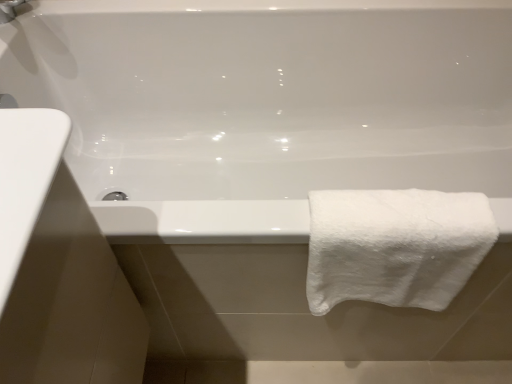
Question: In the image, is matte silver faucet at upper left on the left side or the right side of white fluffy towel at right?

Choices:
 (A) right
 (B) left

Answer: (B)

Question: Is matte silver faucet at upper left wider or thinner than white fluffy towel at right?

Choices:
 (A) wide
 (B) thin

Answer: (B)

Question: In terms of size, does matte silver faucet at upper left appear bigger or smaller than white fluffy towel at right?

Choices:
 (A) big
 (B) small

Answer: (B)

Question: Looking at the image, does white fluffy towel at right seem bigger or smaller compared to matte silver faucet at upper left?

Choices:
 (A) big
 (B) small

Answer: (A)

Question: Does point (403, 193) appear closer or farther from the camera than point (15, 11)?

Choices:
 (A) closer
 (B) farther

Answer: (A)

Question: Is white fluffy towel at right situated inside matte silver faucet at upper left or outside?

Choices:
 (A) outside
 (B) inside

Answer: (A)

Question: From a real-world perspective, is white fluffy towel at right physically located above or below matte silver faucet at upper left?

Choices:
 (A) below
 (B) above

Answer: (A)